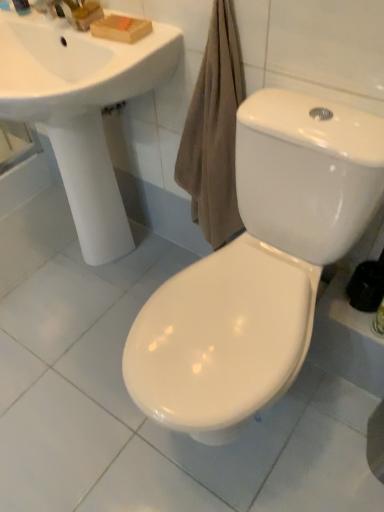
Where is `vacant location below white glossy sink at upper left (from a real-world perspective)`? The height and width of the screenshot is (512, 384). vacant location below white glossy sink at upper left (from a real-world perspective) is located at coordinates (86, 273).